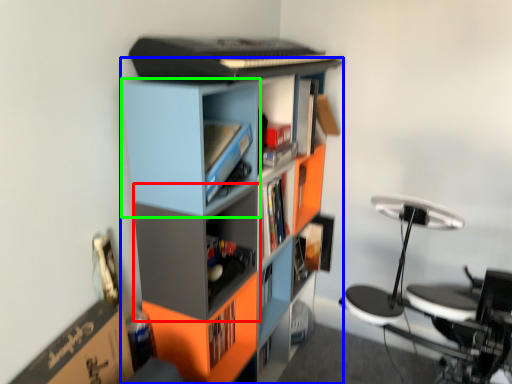
Question: Which is farther away from shelf (highlighted by a red box)? bookcase (highlighted by a blue box) or cabinet (highlighted by a green box)?

Choices:
 (A) bookcase
 (B) cabinet

Answer: (B)